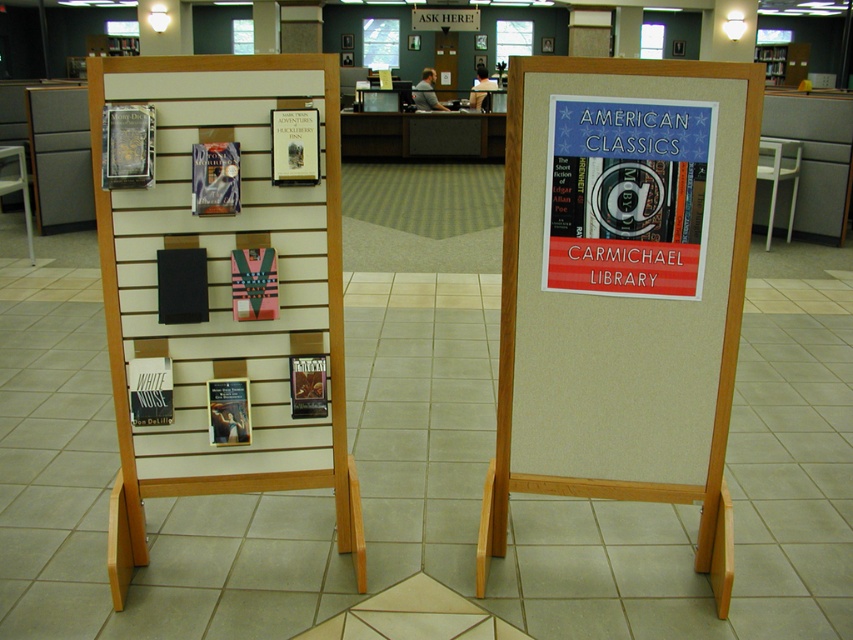
Question: Is white matte book at center positioned in front of matte hardcover book at center?

Choices:
 (A) yes
 (B) no

Answer: (A)

Question: Can you confirm if metallic silver book at center is positioned to the left of matte hardcover book at center?

Choices:
 (A) yes
 (B) no

Answer: (B)

Question: Which point is farther to the camera?

Choices:
 (A) (788, 225)
 (B) (234, 157)
 (C) (297, 412)

Answer: (A)

Question: Is wooden frame at center positioned before metallic silver poster at center?

Choices:
 (A) no
 (B) yes

Answer: (B)

Question: Based on their relative distances, which object is nearer to the wooden frame at center?

Choices:
 (A) wooden bookshelf at upper right
 (B) white matte book at center

Answer: (B)

Question: Which of the following is the closest to the observer?

Choices:
 (A) metallic silver poster at center
 (B) metallic silver book at center
 (C) matte hardcover book at center

Answer: (B)